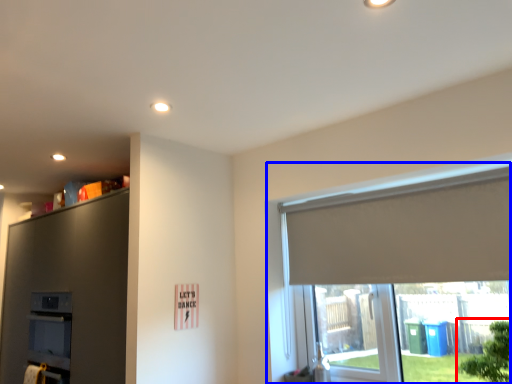
Question: Which of the following is the farthest to the observer, tree (highlighted by a red box) or window (highlighted by a blue box)?

Choices:
 (A) tree
 (B) window

Answer: (B)